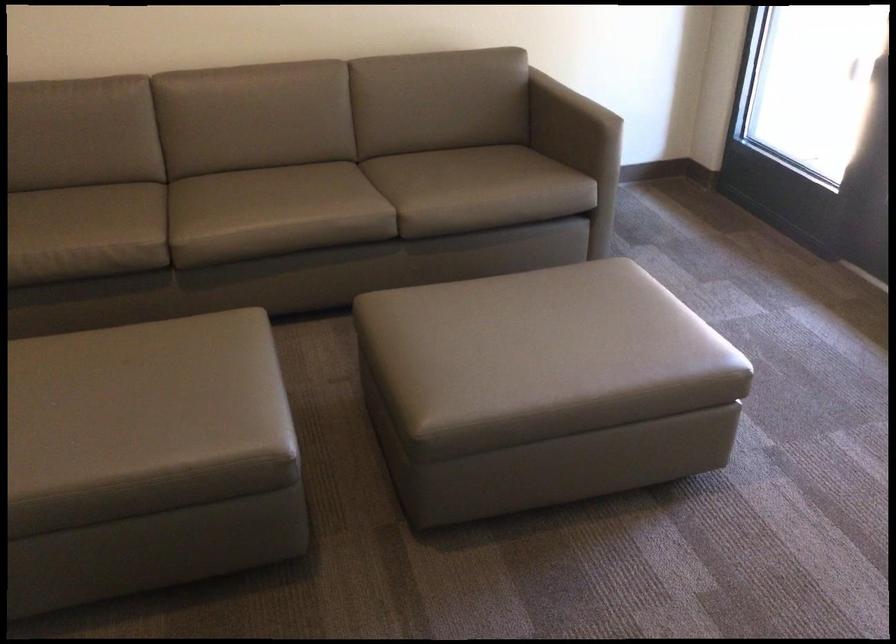
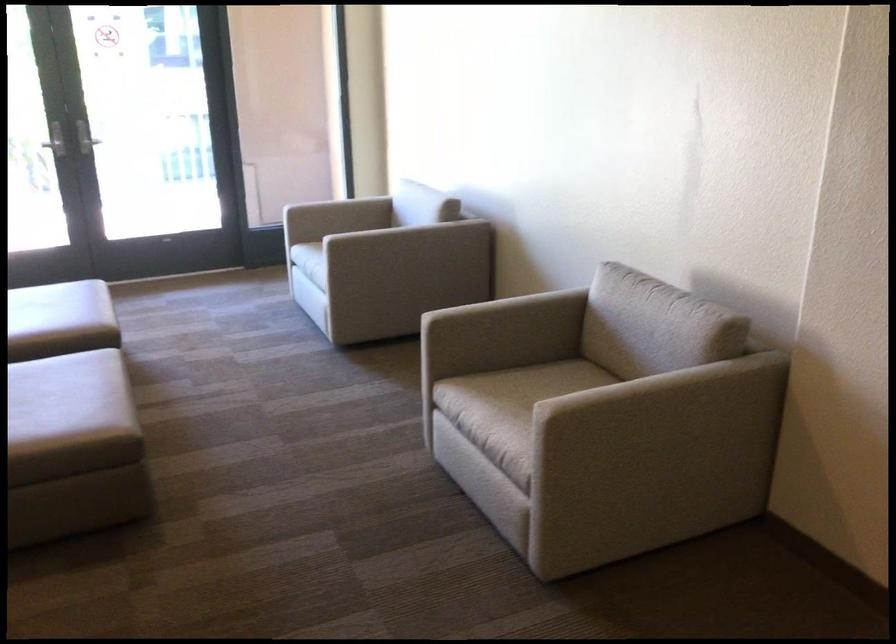
Where in the second image is the point corresponding to pixel 507 370 from the first image?

(58, 308)